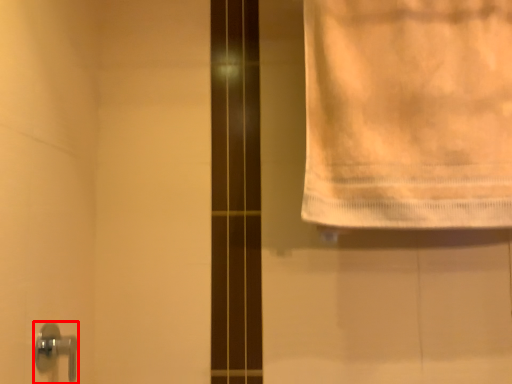
Question: Observing the image, what is the correct spatial positioning of door handle (annotated by the red box) in reference to towel?

Choices:
 (A) left
 (B) right

Answer: (A)